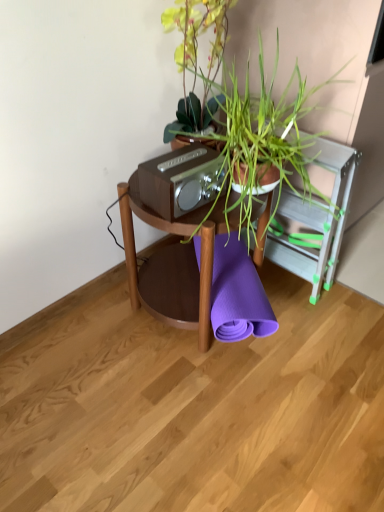
Question: Should I look upward or downward to see woodenmaterial/texturetable at center?

Choices:
 (A) up
 (B) down

Answer: (A)

Question: Does purple rubber yoga mat at center have a smaller size compared to woodenmaterial/texturetable at center?

Choices:
 (A) yes
 (B) no

Answer: (A)

Question: Considering the relative sizes of purple rubber yoga mat at center and woodenmaterial/texturetable at center in the image provided, is purple rubber yoga mat at center shorter than woodenmaterial/texturetable at center?

Choices:
 (A) no
 (B) yes

Answer: (B)

Question: From a real-world perspective, does purple rubber yoga mat at center sit lower than woodenmaterial/texturetable at center?

Choices:
 (A) no
 (B) yes

Answer: (B)

Question: Can you confirm if purple rubber yoga mat at center is positioned to the right of woodenmaterial/texturetable at center?

Choices:
 (A) no
 (B) yes

Answer: (B)

Question: From the image's perspective, is purple rubber yoga mat at center on woodenmaterial/texturetable at center?

Choices:
 (A) yes
 (B) no

Answer: (B)

Question: Are purple rubber yoga mat at center and woodenmaterial/texturetable at center making contact?

Choices:
 (A) yes
 (B) no

Answer: (B)

Question: Can you confirm if woodenmaterial/texturetable at center is taller than purple rubber yoga mat at center?

Choices:
 (A) no
 (B) yes

Answer: (B)

Question: Considering the relative sizes of woodenmaterial/texturetable at center and purple rubber yoga mat at center in the image provided, is woodenmaterial/texturetable at center bigger than purple rubber yoga mat at center?

Choices:
 (A) no
 (B) yes

Answer: (B)

Question: Is woodenmaterial/texturetable at center smaller than purple rubber yoga mat at center?

Choices:
 (A) yes
 (B) no

Answer: (B)

Question: Is woodenmaterial/texturetable at center at the left side of purple rubber yoga mat at center?

Choices:
 (A) no
 (B) yes

Answer: (B)

Question: Considering the relative sizes of woodenmaterial/texturetable at center and purple rubber yoga mat at center in the image provided, is woodenmaterial/texturetable at center wider than purple rubber yoga mat at center?

Choices:
 (A) yes
 (B) no

Answer: (B)

Question: Is woodenmaterial/texturetable at center to the right of purple rubber yoga mat at center from the viewer's perspective?

Choices:
 (A) no
 (B) yes

Answer: (A)

Question: From a real-world perspective, is green leafy plant at center beneath matte brown stereo at center?

Choices:
 (A) yes
 (B) no

Answer: (B)